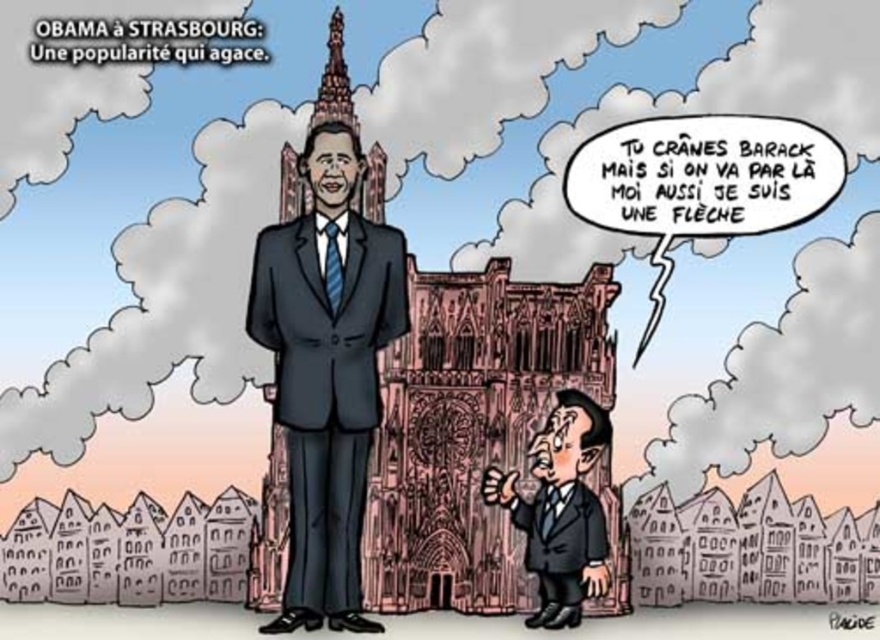
Who is more forward, (589, 496) or (532, 563)?

Point (532, 563) is more forward.

Is dark gray suit at lower right to the left of matte black suit at lower right from the viewer's perspective?

Indeed, dark gray suit at lower right is positioned on the left side of matte black suit at lower right.

Which is in front, point (550, 426) or point (552, 560)?

Point (550, 426) is more forward.

Find the location of a particular element. This screenshot has height=640, width=880. dark gray suit at lower right is located at coordinates (560, 509).

Who is positioned more to the left, matte black suit at center or matte black suit at lower right?

matte black suit at center is more to the left.

Does matte black suit at center have a smaller size compared to matte black suit at lower right?

Actually, matte black suit at center might be larger than matte black suit at lower right.

Find the location of a particular element. This screenshot has height=640, width=880. matte black suit at center is located at coordinates (326, 371).

Can you confirm if matte black suit at center is bigger than dark gray suit at lower right?

Yes.

Which is more to the left, matte black suit at center or dark gray suit at lower right?

matte black suit at center

Is point (290, 609) closer to camera compared to point (595, 588)?

Yes, it is.

Locate an element on the screen. The width and height of the screenshot is (880, 640). matte black suit at center is located at coordinates (326, 371).